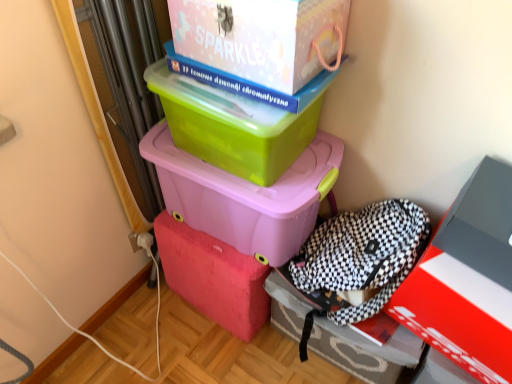
Question: Is checkered fabric backpack at lower right, arranged as the first box when ordered from the bottom, far away from matte white cardboard box at upper center, marked as the fifth box in a bottom-to-top arrangement?

Choices:
 (A) yes
 (B) no

Answer: (B)

Question: Is checkered fabric backpack at lower right, arranged as the first box when ordered from the bottom, in front of matte white cardboard box at upper center, marked as the fifth box in a bottom-to-top arrangement?

Choices:
 (A) no
 (B) yes

Answer: (A)

Question: Can you confirm if checkered fabric backpack at lower right, arranged as the first box when ordered from the bottom, is bigger than matte white cardboard box at upper center, marked as the fifth box in a bottom-to-top arrangement?

Choices:
 (A) yes
 (B) no

Answer: (A)

Question: Is matte white cardboard box at upper center, the first box viewed from the top, inside checkered fabric backpack at lower right, arranged as the first box when ordered from the bottom?

Choices:
 (A) yes
 (B) no

Answer: (B)

Question: From a real-world perspective, does checkered fabric backpack at lower right, arranged as the first box when ordered from the bottom, sit lower than matte white cardboard box at upper center, marked as the fifth box in a bottom-to-top arrangement?

Choices:
 (A) yes
 (B) no

Answer: (A)

Question: Relative to matte white cardboard box at upper center, the first box viewed from the top, is checkered fabric backpack at lower right, arranged as the first box when ordered from the bottom, in front or behind?

Choices:
 (A) front
 (B) behind

Answer: (B)

Question: Is checkered fabric backpack at lower right, arranged as the first box when ordered from the bottom, inside the boundaries of matte white cardboard box at upper center, the first box viewed from the top, or outside?

Choices:
 (A) inside
 (B) outside

Answer: (B)

Question: Would you say checkered fabric backpack at lower right, which appears as the 5th box when viewed from the top, is to the left or to the right of matte white cardboard box at upper center, the first box viewed from the top, in the picture?

Choices:
 (A) right
 (B) left

Answer: (A)

Question: In terms of height, does checkered fabric backpack at lower right, which appears as the 5th box when viewed from the top, look taller or shorter compared to matte white cardboard box at upper center, marked as the fifth box in a bottom-to-top arrangement?

Choices:
 (A) short
 (B) tall

Answer: (B)

Question: Based on their sizes in the image, would you say matte red box at lower right, placed as the fourth box when sorted from top to bottom, is bigger or smaller than matte white cardboard box at upper center, the first box viewed from the top?

Choices:
 (A) small
 (B) big

Answer: (B)

Question: From the image's perspective, is matte red box at lower right, positioned as the 2th box in bottom-to-top order, located above or below matte white cardboard box at upper center, the first box viewed from the top?

Choices:
 (A) above
 (B) below

Answer: (B)

Question: Considering their positions, is matte red box at lower right, placed as the fourth box when sorted from top to bottom, located in front of or behind matte white cardboard box at upper center, the first box viewed from the top?

Choices:
 (A) front
 (B) behind

Answer: (B)

Question: Is matte red box at lower right, positioned as the 2th box in bottom-to-top order, taller or shorter than matte white cardboard box at upper center, the first box viewed from the top?

Choices:
 (A) tall
 (B) short

Answer: (A)

Question: From the image's perspective, relative to green plastic box at upper center, which is counted as the 4th box, starting from the bottom, is matte plastic storage box at center, marked as the third box in a top-to-bottom arrangement, above or below?

Choices:
 (A) below
 (B) above

Answer: (A)

Question: From a real-world perspective, is matte plastic storage box at center, marked as the third box in a top-to-bottom arrangement, positioned above or below green plastic box at upper center, which is the second box from top to bottom?

Choices:
 (A) below
 (B) above

Answer: (A)